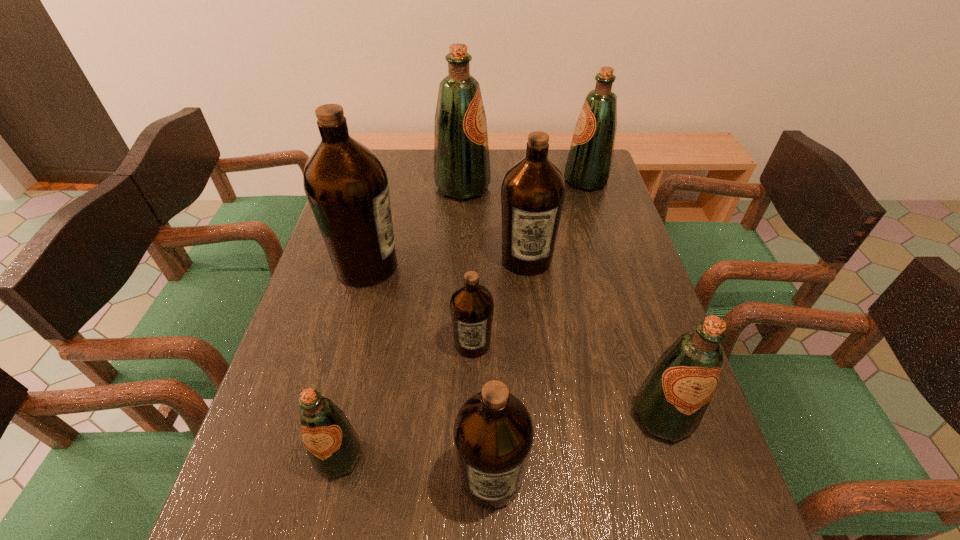
I want to click on free point at the left edge, so click(x=268, y=501).

Locate an element on the screen. The width and height of the screenshot is (960, 540). free space at the right edge of the desktop is located at coordinates (615, 219).

Find the location of a particular element. The width and height of the screenshot is (960, 540). vacant area that lies between the nearest brown olive oil and the third smallest green olive oil is located at coordinates (539, 329).

Locate an element on the screen. This screenshot has width=960, height=540. free spot between the third smallest brown olive oil and the fifth farthest olive oil is located at coordinates coord(499,301).

Identify the location of empty space between the second smallest green olive oil and the third smallest brown olive oil. The width and height of the screenshot is (960, 540). (594, 338).

At what (x,y) coordinates should I click in order to perform the action: click on unoccupied position between the second smallest brown olive oil and the biggest brown olive oil. Please return your answer as a coordinate pair (x, y). This screenshot has width=960, height=540. Looking at the image, I should click on (429, 372).

Where is `vacant space that's between the leftmost green olive oil and the biggest brown olive oil`? Image resolution: width=960 pixels, height=540 pixels. vacant space that's between the leftmost green olive oil and the biggest brown olive oil is located at coordinates (352, 361).

Find the location of a particular element. unoccupied area between the second biggest brown olive oil and the second nearest brown olive oil is located at coordinates (499, 301).

Identify the location of empty space between the third smallest green olive oil and the second smallest green olive oil. (624, 298).

Find the location of `empty space that is in between the second smallest green olive oil and the fifth farthest object`. empty space that is in between the second smallest green olive oil and the fifth farthest object is located at coordinates (567, 380).